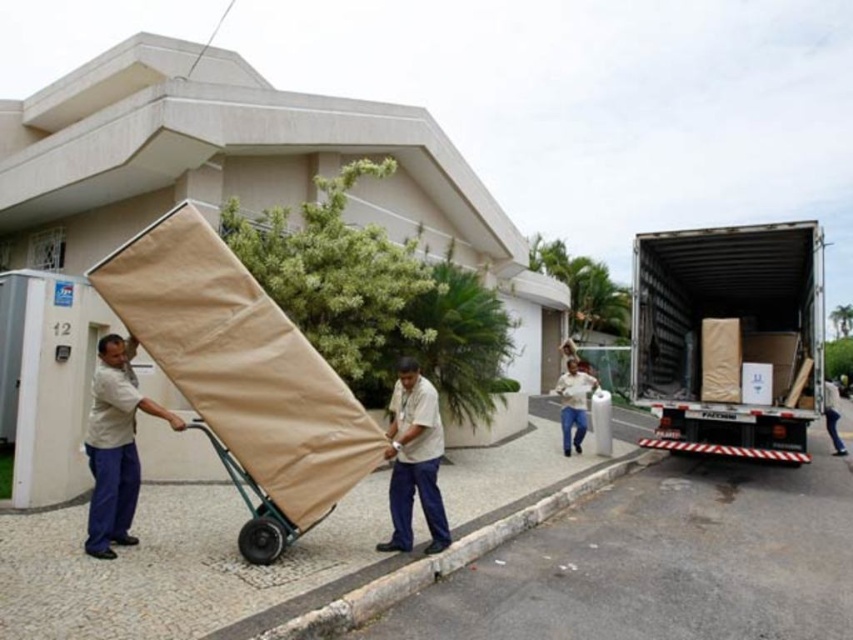
You are a delivery person who just arrived at the address displayed on the building. You need to move the beige fabric cart at center and the white cotton shirt at center into the building. However, the doorway is only 20 feet wide. Can both items fit through the doorway side by side?

The distance between beige fabric cart at center and white cotton shirt at center is 22.11 feet, which exceeds the doorway width of 20 feet. Therefore, they cannot fit through the doorway side by side.

You are a delivery person who just arrived at the building with the number 12. You see the beige fabric cart at center and the white cotton shirt at center. Which object is closer to the truck parked on the right side?

The beige fabric cart at center is to the left of the white cotton shirt at center, so the beige fabric cart at center is closer to the truck parked on the right side.

You are a delivery person trying to unload furniture from the truck. You see two fabrics, the light beige fabric at left and the light brown fabric at center. Which fabric is closer to the truck?

The light beige fabric at left is closer to the truck because it is in front of the light brown fabric at center.